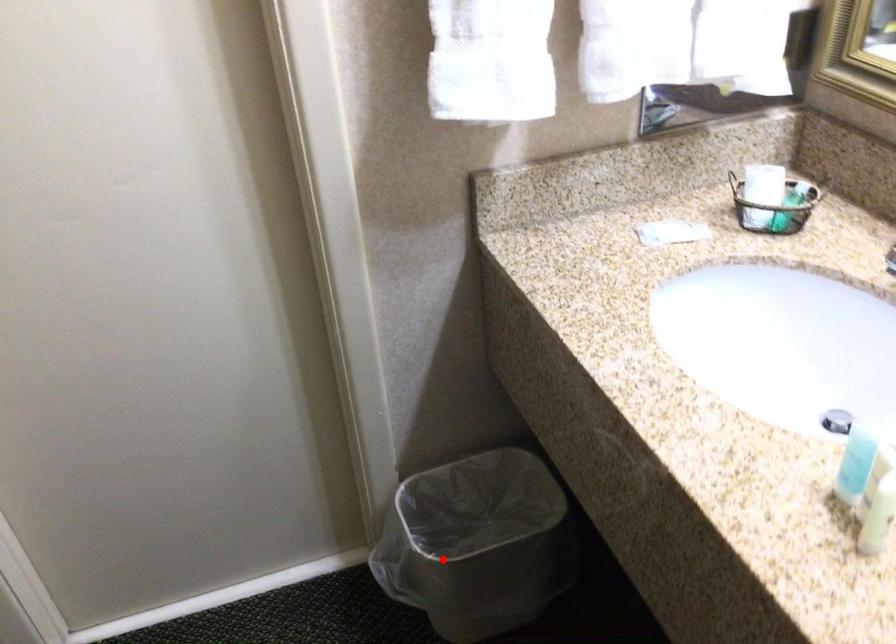
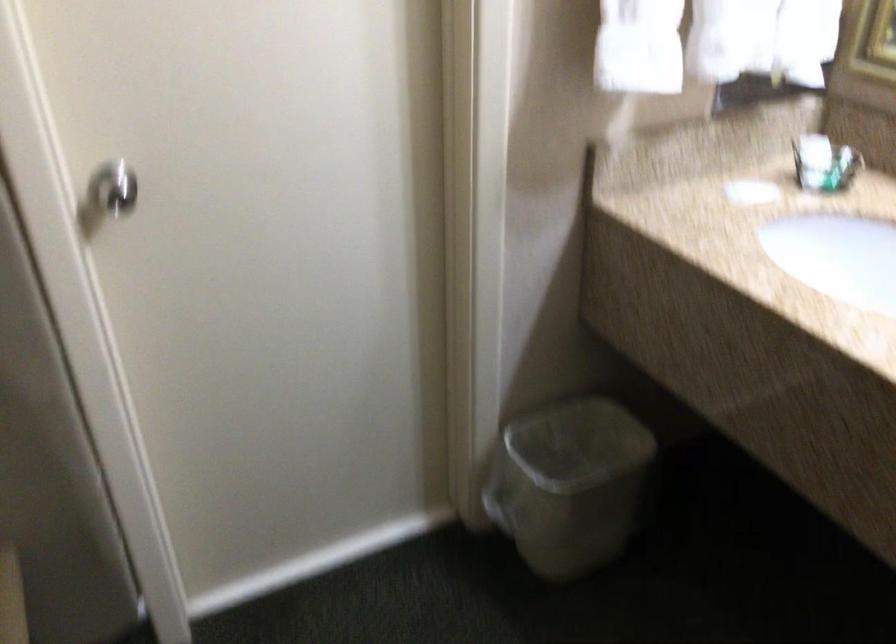
Find the pixel in the second image that matches the highlighted location in the first image.

(570, 484)